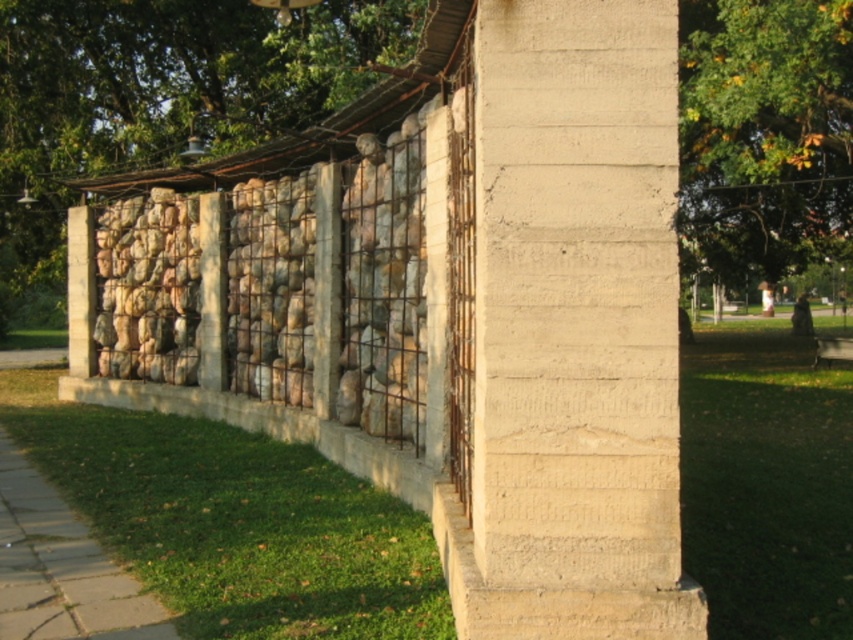
Question: Does smooth concrete pillar at center appear over natural stone wall at center?

Choices:
 (A) yes
 (B) no

Answer: (B)

Question: Does natural stone wall at center appear on the left side of green leafy tree at upper right?

Choices:
 (A) yes
 (B) no

Answer: (A)

Question: Based on their relative distances, which object is nearer to the natural stone wall at center?

Choices:
 (A) smooth concrete pillar at center
 (B) green leafy tree at upper right

Answer: (B)

Question: Which object is the closest to the green leafy tree at upper right?

Choices:
 (A) natural stone wall at center
 (B) smooth concrete pillar at center

Answer: (B)

Question: Where is smooth concrete pillar at center located in relation to green leafy tree at upper right in the image?

Choices:
 (A) below
 (B) above

Answer: (A)

Question: Which object is the farthest from the green leafy tree at upper right?

Choices:
 (A) smooth concrete pillar at center
 (B) natural stone wall at center

Answer: (B)